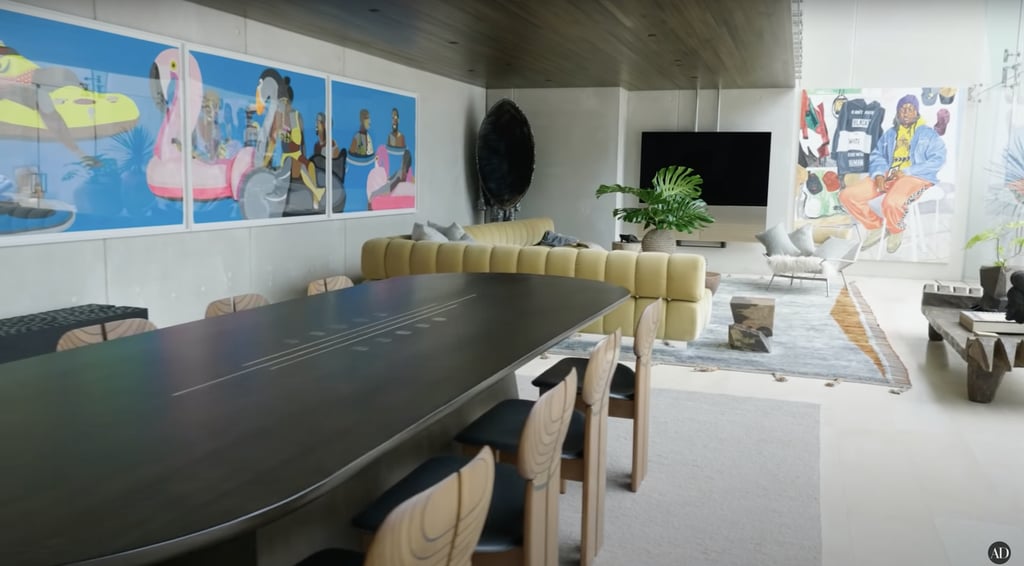
Find the location of a particular element. This screenshot has width=1024, height=566. white tiled floor is located at coordinates (905, 424).